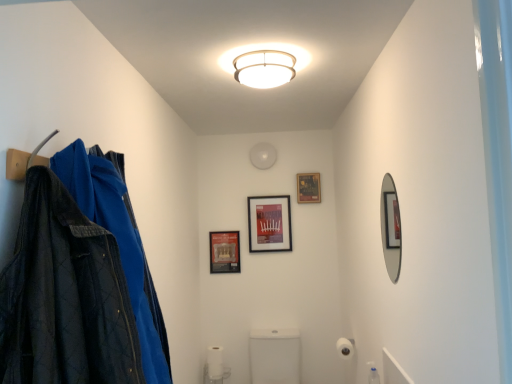
Question: Considering the positions of matte black picture frame at center, the 3th picture frame when ordered from right to left, and white matte toilet paper at lower center, the 2th toilet paper from the top, in the image, is matte black picture frame at center, the 3th picture frame when ordered from right to left, taller or shorter than white matte toilet paper at lower center, the 2th toilet paper from the top,?

Choices:
 (A) tall
 (B) short

Answer: (A)

Question: Considering the positions of point (219, 271) and point (207, 349), is point (219, 271) closer or farther from the camera than point (207, 349)?

Choices:
 (A) closer
 (B) farther

Answer: (B)

Question: Which of these objects is positioned farthest from the white matte toilet paper at lower right, which appears as the 1th toilet paper when viewed from the right?

Choices:
 (A) matte black picture frame at upper center, placed as the 3th picture frame when sorted from left to right
 (B) silver-framed mirror at right
 (C) matte black picture frame at center, placed as the second picture frame when sorted from left to right
 (D) matte black picture frame at center, arranged as the first picture frame when viewed from the left
 (E) white glossy toilet at center

Answer: (B)

Question: Which of these objects is positioned farthest from the white glossy toilet at center?

Choices:
 (A) matte black picture frame at center, the 2th picture frame positioned from the right
 (B) silver-framed mirror at right
 (C) white matte toilet paper at lower center, which is the second toilet paper in right-to-left order
 (D) matte black picture frame at upper center, acting as the 1th picture frame starting from the right
 (E) matte black picture frame at center, arranged as the first picture frame when viewed from the left

Answer: (B)